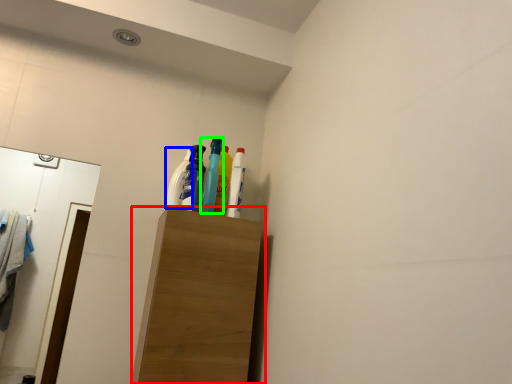
Question: Which object is the closest to the furniture (highlighted by a red box)? Choose among these: cleaning product (highlighted by a blue box) or bottle (highlighted by a green box).

Choices:
 (A) cleaning product
 (B) bottle

Answer: (B)